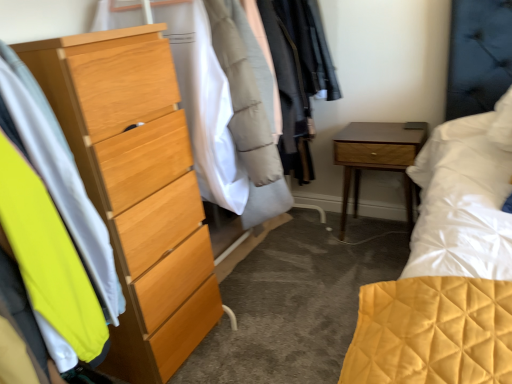
Question: From a real-world perspective, does wooden nightstand at lower right stand above neon yellow fabric at left?

Choices:
 (A) no
 (B) yes

Answer: (A)

Question: Does wooden nightstand at lower right lie behind neon yellow fabric at left?

Choices:
 (A) yes
 (B) no

Answer: (A)

Question: From the image's perspective, is wooden nightstand at lower right on top of neon yellow fabric at left?

Choices:
 (A) no
 (B) yes

Answer: (B)

Question: Is wooden nightstand at lower right positioned with its back to neon yellow fabric at left?

Choices:
 (A) no
 (B) yes

Answer: (A)

Question: Is neon yellow fabric at left inside wooden nightstand at lower right?

Choices:
 (A) no
 (B) yes

Answer: (A)

Question: Considering the positions of neon yellow fabric at left and light wood dresser at left in the image, is neon yellow fabric at left wider or thinner than light wood dresser at left?

Choices:
 (A) wide
 (B) thin

Answer: (B)

Question: From the image's perspective, relative to light wood dresser at left, is neon yellow fabric at left above or below?

Choices:
 (A) below
 (B) above

Answer: (B)

Question: Relative to light wood dresser at left, is neon yellow fabric at left in front or behind?

Choices:
 (A) behind
 (B) front

Answer: (B)

Question: Visually, is neon yellow fabric at left positioned to the left or to the right of light wood dresser at left?

Choices:
 (A) left
 (B) right

Answer: (A)

Question: Choose the correct answer: Is light wood dresser at left inside wooden nightstand at lower right or outside it?

Choices:
 (A) outside
 (B) inside

Answer: (A)

Question: Is point (194, 332) positioned closer to the camera than point (360, 125)?

Choices:
 (A) closer
 (B) farther

Answer: (A)

Question: From a real-world perspective, is light wood dresser at left positioned above or below wooden nightstand at lower right?

Choices:
 (A) below
 (B) above

Answer: (B)

Question: Considering the positions of light wood dresser at left and wooden nightstand at lower right in the image, is light wood dresser at left wider or thinner than wooden nightstand at lower right?

Choices:
 (A) thin
 (B) wide

Answer: (B)

Question: In the image, is wooden nightstand at lower right positioned in front of or behind neon yellow fabric at left?

Choices:
 (A) front
 (B) behind

Answer: (B)

Question: Considering the positions of point (424, 139) and point (39, 140), is point (424, 139) closer or farther from the camera than point (39, 140)?

Choices:
 (A) closer
 (B) farther

Answer: (B)